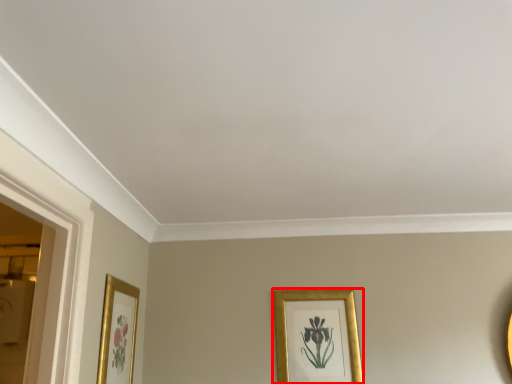
Question: Observing the image, what is the correct spatial positioning of picture frame (annotated by the red box) in reference to picture frame?

Choices:
 (A) right
 (B) left

Answer: (A)